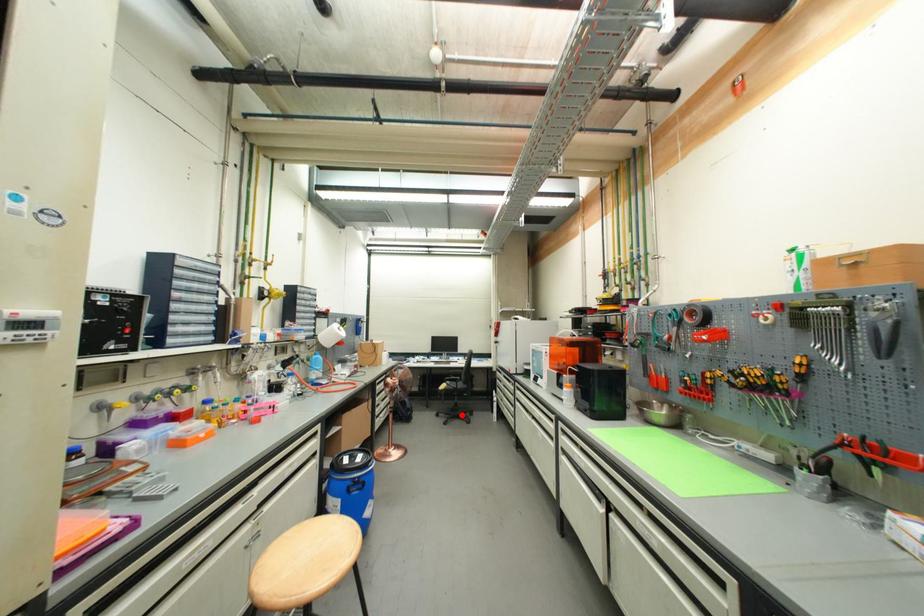
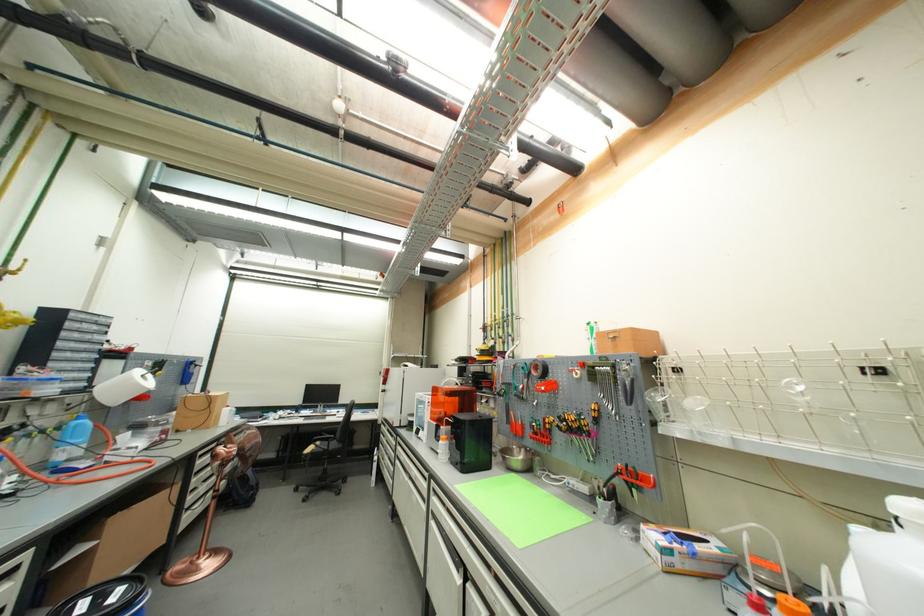
In the second image, find the point that corresponds to the highlighted location in the first image.

(330, 485)